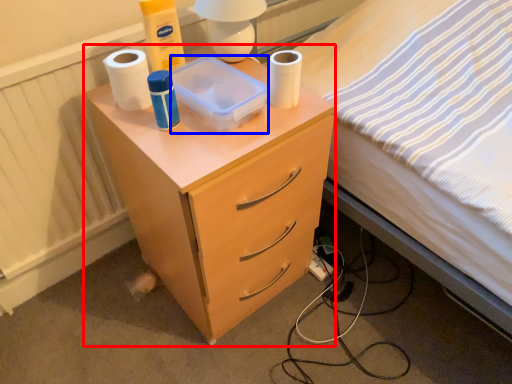
Question: Which point is further to the camera, nightstand (highlighted by a red box) or box (highlighted by a blue box)?

Choices:
 (A) nightstand
 (B) box

Answer: (B)